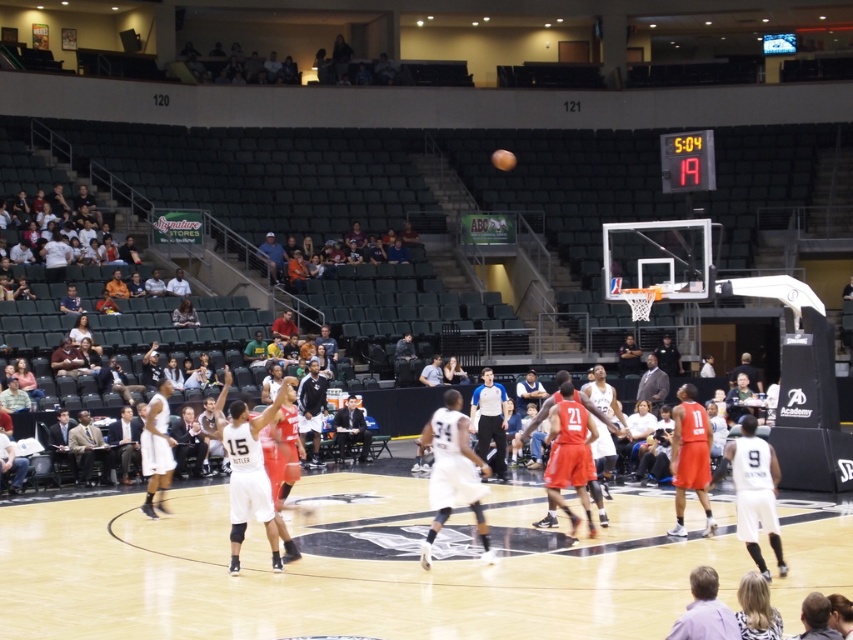
Can you confirm if black suit at center is shorter than dark gray suit at center?

Incorrect, black suit at center's height does not fall short of dark gray suit at center's.

In the scene shown: Does black suit at center lie behind dark gray suit at center?

→ No.

Is point (341, 442) positioned before point (662, 380)?

That is True.

Identify the location of black suit at center. (351, 429).

Does suede brown suit at lower left have a lesser height compared to shiny orange basketball at center?

Yes, suede brown suit at lower left is shorter than shiny orange basketball at center.

Describe the element at coordinates (90, 449) in the screenshot. I see `suede brown suit at lower left` at that location.

The width and height of the screenshot is (853, 640). Find the location of `suede brown suit at lower left`. suede brown suit at lower left is located at coordinates (90, 449).

Is wooden polished basketball court at center smaller than dark gray suit at center?

No.

Does point (309, 600) come closer to viewer compared to point (646, 397)?

Yes, it is.

Is point (468, 602) positioned in front of point (637, 392)?

Yes, point (468, 602) is in front of point (637, 392).

Where is `wooden polished basketball court at center`? wooden polished basketball court at center is located at coordinates point(352,566).